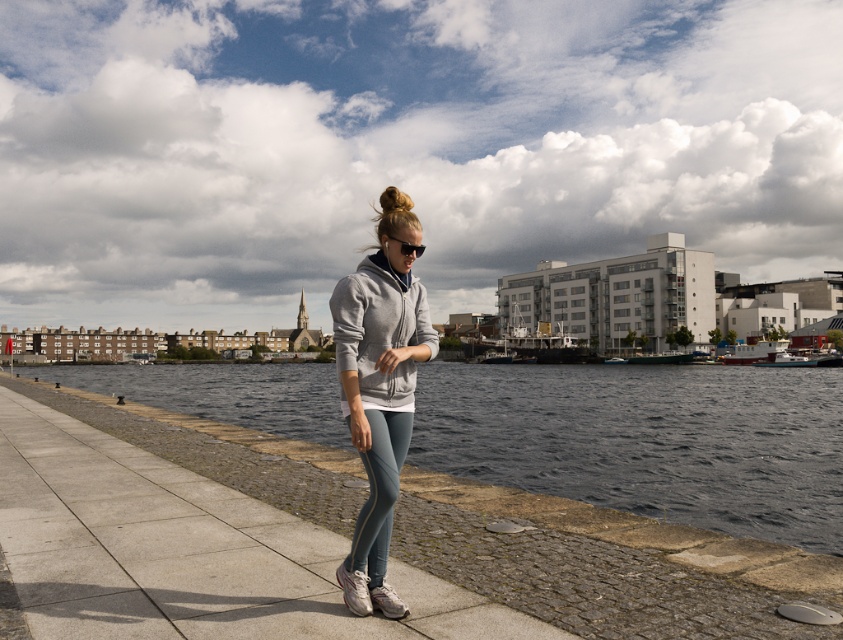
Can you confirm if gray fleece sweatshirt at center is bigger than blonde hair at center?

Incorrect, gray fleece sweatshirt at center is not larger than blonde hair at center.

Based on the photo, does gray fleece sweatshirt at center come behind blonde hair at center?

That is False.

What do you see at coordinates (379, 330) in the screenshot? I see `gray fleece sweatshirt at center` at bounding box center [379, 330].

Locate an element on the screen. Image resolution: width=843 pixels, height=640 pixels. gray fleece sweatshirt at center is located at coordinates (379, 330).

Who is more distant from viewer, [793,506] or [368,342]?

The point [793,506] is behind.

Is dark blue water at center in front of matte gray hoodie at center?

No, it is not.

Locate an element on the screen. This screenshot has height=640, width=843. dark blue water at center is located at coordinates (648, 440).

Is matte gray hoodie at center taller than gray fleece sweatshirt at center?

Indeed, matte gray hoodie at center has a greater height compared to gray fleece sweatshirt at center.

Between matte gray hoodie at center and gray fleece sweatshirt at center, which one appears on the left side from the viewer's perspective?

Positioned to the left is gray fleece sweatshirt at center.

Locate an element on the screen. matte gray hoodie at center is located at coordinates (379, 396).